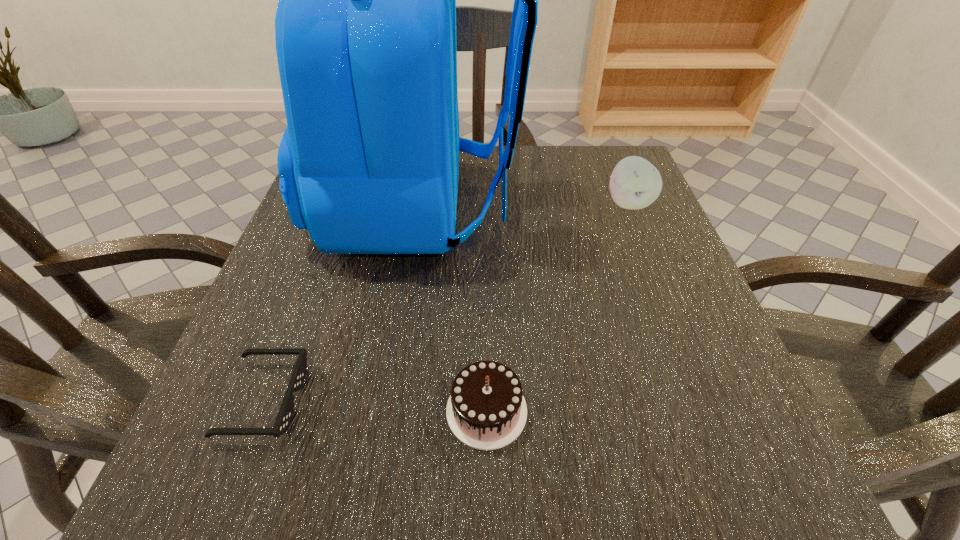
What are the coordinates of `the tallest object` in the screenshot? It's located at (365, 28).

Find the location of `the second tallest object`. the second tallest object is located at coordinates (635, 183).

The width and height of the screenshot is (960, 540). In order to click on the rightmost object in this screenshot , I will do `click(635, 183)`.

Find the location of `chocolate cake`. chocolate cake is located at coordinates (486, 410).

You are a GUI agent. You are given a task and a screenshot of the screen. Output one action in this format:
    pyautogui.click(x=<x>, y=<y>)
    Task: Click on the sunglasses
    This screenshot has height=540, width=960.
    Given the screenshot: What is the action you would take?
    pyautogui.click(x=285, y=414)

Locate an element on the screen. free space located 0.160m on the back of the tallest object is located at coordinates (595, 208).

Where is `free space located 0.390m on the left of the rightmost object`? free space located 0.390m on the left of the rightmost object is located at coordinates [x=420, y=203].

Locate an element on the screen. The height and width of the screenshot is (540, 960). vacant space located 0.160m on the right of the chocolate cake is located at coordinates (645, 411).

Identify the location of vacant space situated on the front-facing side of the sunglasses. (414, 399).

Identify the location of backpack present at the far edge. (365, 28).